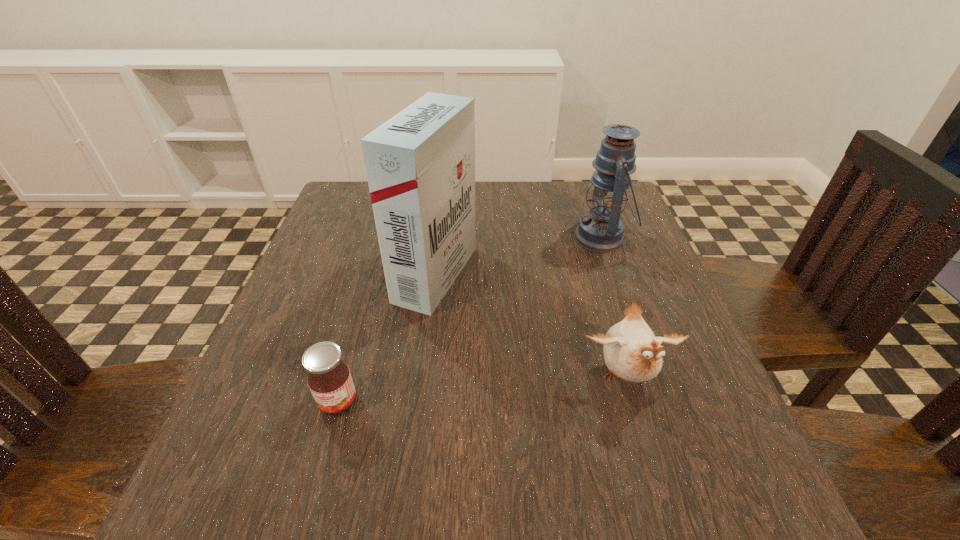
This screenshot has width=960, height=540. Find the location of `free space between the lantern and the leftmost object`. free space between the lantern and the leftmost object is located at coordinates (469, 320).

The image size is (960, 540). I want to click on free spot between the second shortest object and the third object from right to left, so click(531, 327).

The image size is (960, 540). I want to click on object that can be found as the closest to the third object from right to left, so click(329, 379).

This screenshot has width=960, height=540. I want to click on object that is the closest to the lantern, so click(420, 164).

In order to click on free location that satisfies the following two spatial constraints: 1. on the front-facing side of the second tallest object; 2. at the beak of the bird in this screenshot , I will do `click(652, 379)`.

Locate an element on the screen. The image size is (960, 540). vacant space that satisfies the following two spatial constraints: 1. on the front-facing side of the lantern; 2. on the label side of the shortest object is located at coordinates (660, 402).